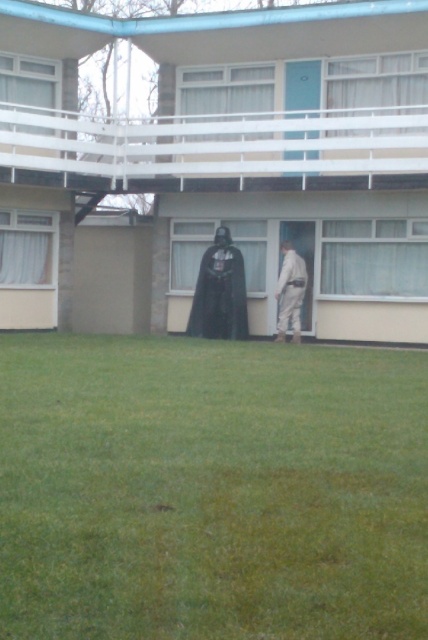
Question: Does green grass at lower center have a larger size compared to black matte cloak at center?

Choices:
 (A) yes
 (B) no

Answer: (A)

Question: Which object is closer to the camera taking this photo?

Choices:
 (A) green grass at lower center
 (B) black matte cloak at center

Answer: (A)

Question: Does black matte cloak at center have a smaller size compared to white fabric pants at lower center?

Choices:
 (A) no
 (B) yes

Answer: (A)

Question: Which object appears closest to the camera in this image?

Choices:
 (A) green grass at lower center
 (B) black matte cloak at center

Answer: (A)

Question: Is green grass at lower center to the right of white fabric pants at lower center from the viewer's perspective?

Choices:
 (A) yes
 (B) no

Answer: (B)

Question: Which is farther from the black matte cloak at center?

Choices:
 (A) green grass at lower center
 (B) white fabric pants at lower center

Answer: (A)